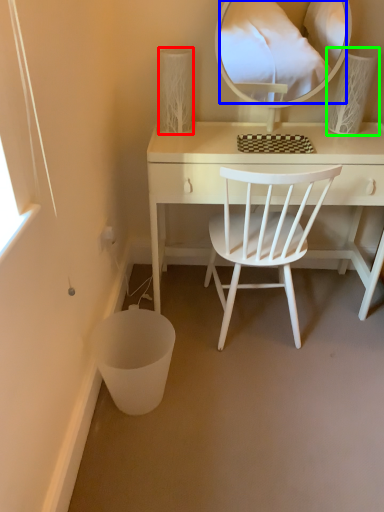
Question: Estimate the real-world distances between objects in this image. Which object is farther from table lamp (highlighted by a red box), mirror (highlighted by a blue box) or table lamp (highlighted by a green box)?

Choices:
 (A) mirror
 (B) table lamp

Answer: (A)